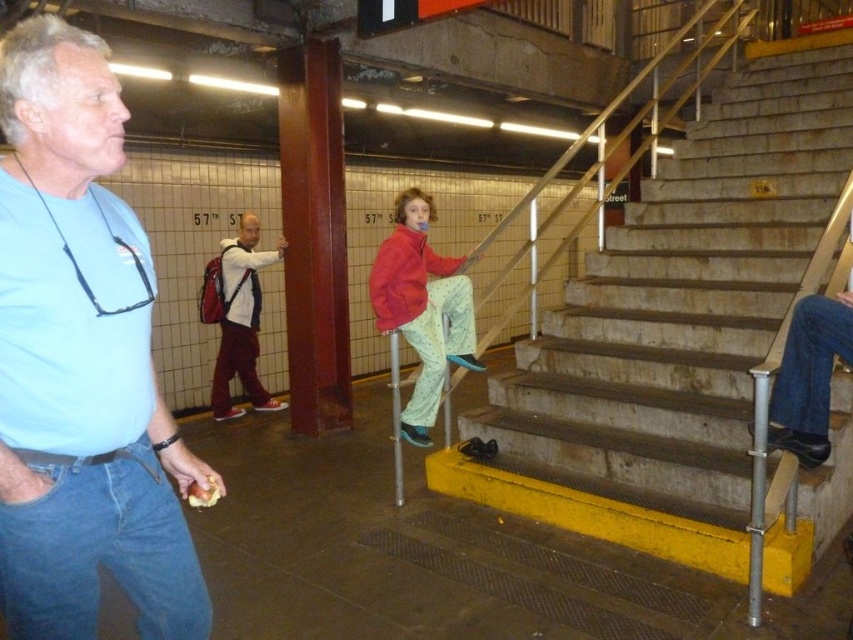
Is point (672, 298) positioned in front of point (97, 451)?

That is False.

Between concrete stairs at center and light blue t-shirt at left, which one has less height?

With less height is light blue t-shirt at left.

Does point (508, 438) come closer to viewer compared to point (45, 29)?

No, (508, 438) is further to viewer.

Find the location of a particular element. This screenshot has width=853, height=640. concrete stairs at center is located at coordinates pos(675,330).

Describe the element at coordinates (80, 362) in the screenshot. I see `light blue t-shirt at left` at that location.

Between light blue t-shirt at left and red fleece jacket at center, which one is positioned higher?

Positioned higher is red fleece jacket at center.

The height and width of the screenshot is (640, 853). I want to click on light blue t-shirt at left, so click(80, 362).

Between point (666, 392) and point (424, 346), which one is positioned in front?

Positioned in front is point (424, 346).

Which is below, concrete stairs at center or red fleece jacket at center?

red fleece jacket at center is below.

This screenshot has width=853, height=640. I want to click on concrete stairs at center, so click(675, 330).

This screenshot has height=640, width=853. Find the location of `concrete stairs at center`. concrete stairs at center is located at coordinates (675, 330).